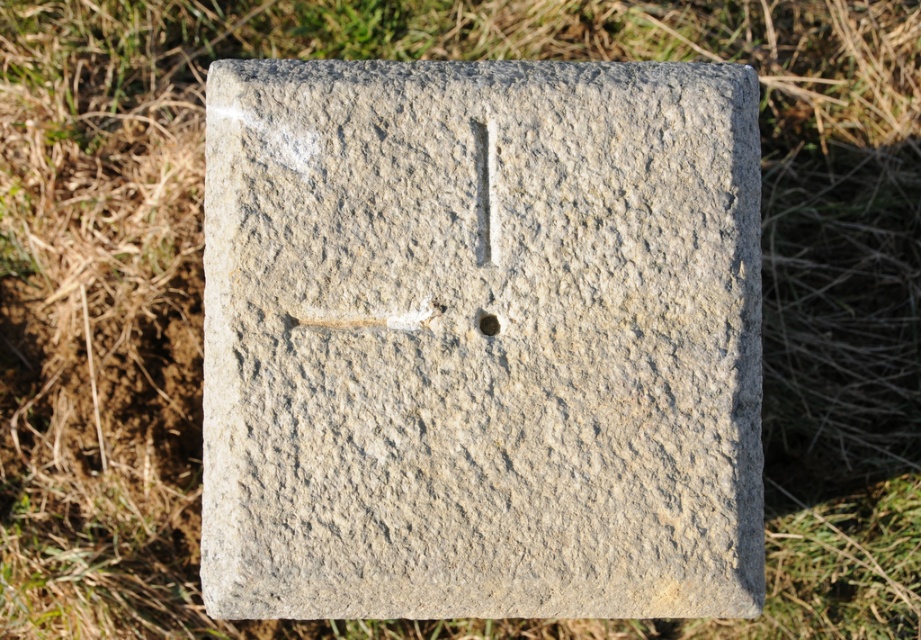
Question: Is gray stone gravestone at center behind black stone hole at center?

Choices:
 (A) no
 (B) yes

Answer: (A)

Question: Which object appears farthest from the camera in this image?

Choices:
 (A) gray stone gravestone at center
 (B) black stone hole at center

Answer: (B)

Question: Is gray stone gravestone at center further to camera compared to black stone hole at center?

Choices:
 (A) yes
 (B) no

Answer: (B)

Question: Can you confirm if gray stone gravestone at center is positioned to the left of black stone hole at center?

Choices:
 (A) yes
 (B) no

Answer: (A)